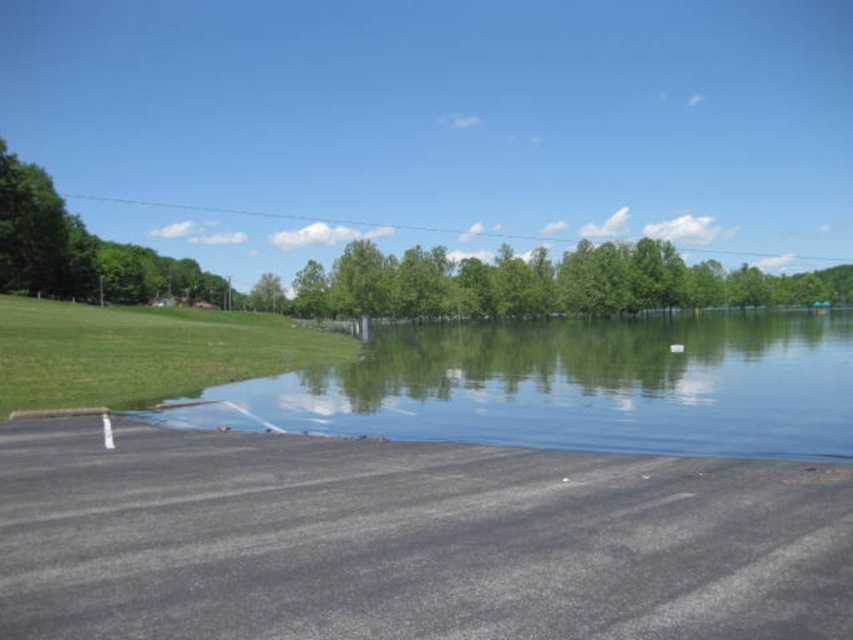
Is clear water at lower center shorter than green leafy trees at center?

Yes, clear water at lower center is shorter than green leafy trees at center.

Is clear water at lower center wider than green leafy trees at center?

No.

At what (x,y) coordinates should I click in order to perform the action: click on clear water at lower center. Please return your answer as a coordinate pair (x, y). The width and height of the screenshot is (853, 640). Looking at the image, I should click on (573, 385).